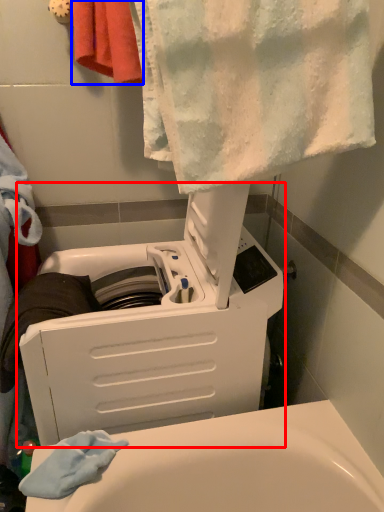
Question: Among these objects, which one is nearest to the camera, appliance (highlighted by a red box) or towel (highlighted by a blue box)?

Choices:
 (A) appliance
 (B) towel

Answer: (A)